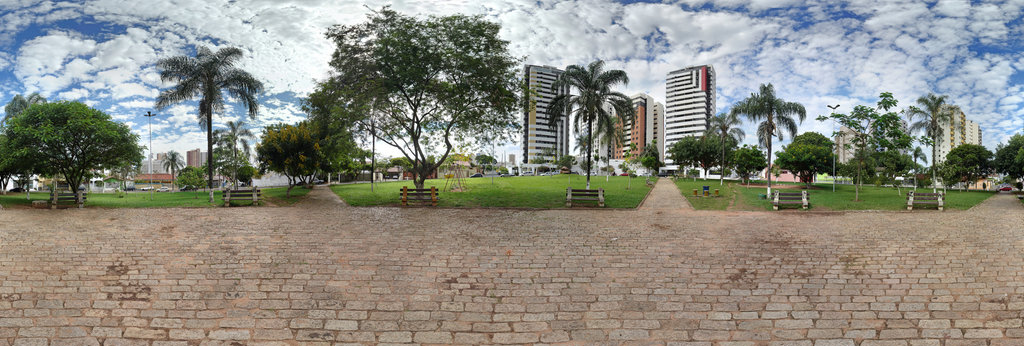
Find the location of a particular element. The width and height of the screenshot is (1024, 346). bench is located at coordinates (798, 200), (916, 195), (426, 194), (583, 193), (243, 194), (61, 194).